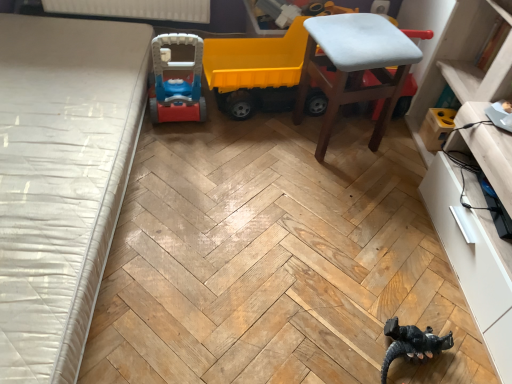
Identify the location of vacant point to the right of black matte toy dinosaur at lower right. (471, 344).